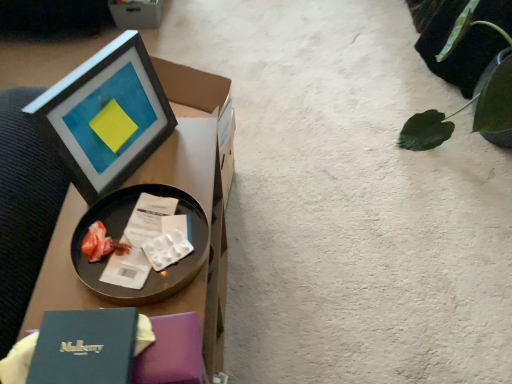
Question: From the image's perspective, is matte black picture frame at upper left positioned above or below green leafy plant at upper right?

Choices:
 (A) below
 (B) above

Answer: (A)

Question: Is matte black picture frame at upper left in front of or behind green leafy plant at upper right in the image?

Choices:
 (A) behind
 (B) front

Answer: (B)

Question: Which of these objects is positioned closest to the metallic tray at left?

Choices:
 (A) matte black picture frame at upper left
 (B) green leafy plant at upper right
 (C) black glossy tray at upper left
 (D) cardboard box at upper left

Answer: (A)

Question: Based on their relative distances, which object is nearer to the matte black picture frame at upper left?

Choices:
 (A) cardboard box at upper left
 (B) black glossy tray at upper left
 (C) green leafy plant at upper right
 (D) metallic tray at left

Answer: (D)